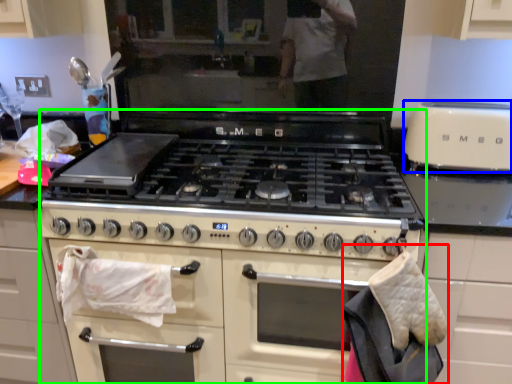
Question: Which object is positioned farthest from material (highlighted by a red box)? Select from kitchen appliance (highlighted by a blue box) and appliance (highlighted by a green box).

Choices:
 (A) kitchen appliance
 (B) appliance

Answer: (A)